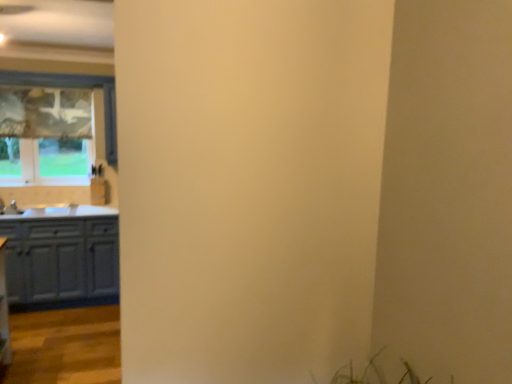
Question: Is matte white cabinets at left bigger or smaller than matte glass window at left?

Choices:
 (A) small
 (B) big

Answer: (B)

Question: Is matte white cabinets at left taller or shorter than matte glass window at left?

Choices:
 (A) tall
 (B) short

Answer: (B)

Question: Visually, is matte white cabinets at left positioned to the left or to the right of matte glass window at left?

Choices:
 (A) left
 (B) right

Answer: (B)

Question: From their relative heights in the image, would you say matte glass window at left is taller or shorter than matte white cabinets at left?

Choices:
 (A) short
 (B) tall

Answer: (B)

Question: Looking at the image, does matte glass window at left seem bigger or smaller compared to matte white cabinets at left?

Choices:
 (A) big
 (B) small

Answer: (B)

Question: From a real-world perspective, is matte glass window at left above or below matte white cabinets at left?

Choices:
 (A) above
 (B) below

Answer: (A)

Question: Is point [74, 180] closer or farther from the camera than point [25, 238]?

Choices:
 (A) closer
 (B) farther

Answer: (B)